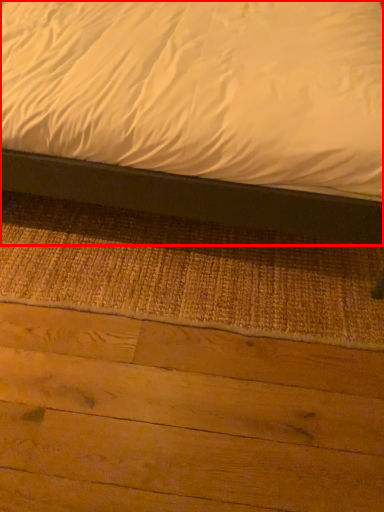
Question: From the image's perspective, where is bed (annotated by the red box) located in relation to plywood in the image?

Choices:
 (A) above
 (B) below

Answer: (A)